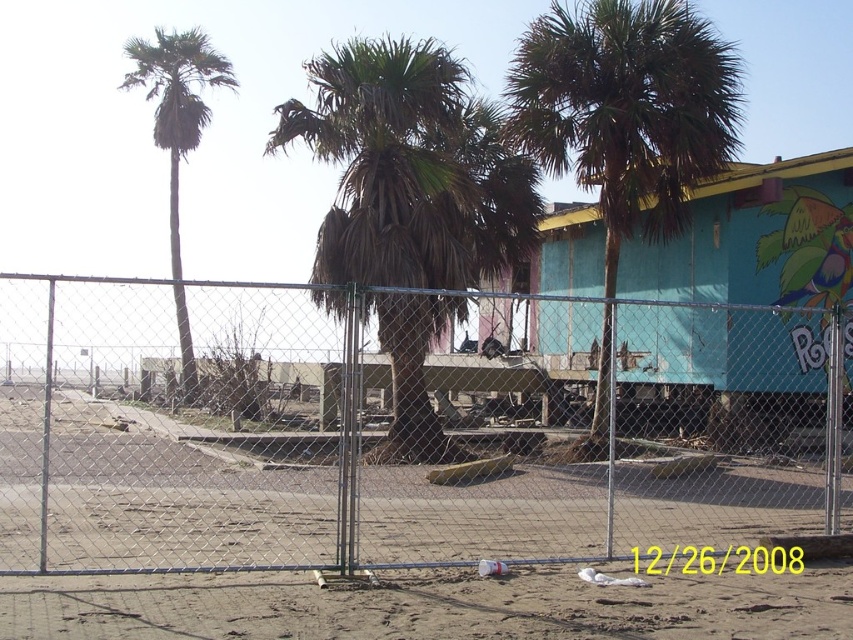
You are standing at the beach and see the teal painted wood cabin at center. If you want to take a photo of it, where should you position yourself relative to the chain link fence in the foreground?

The teal painted wood cabin at center is located at coordinates 0.373 on the x axis and 0.886 on the y axis, so you should position yourself to the right side of the chain link fence to capture it in your photo.

You are a visitor at the beachfront area and want to take a photo that includes both the teal painted wood cabin at center and the green leafy palm tree at center. Based on their sizes, which one should you position closer to the center of your camera frame to ensure both are visible?

The teal painted wood cabin at center is smaller than the green leafy palm tree at center. To ensure both are visible in the photo, you should position the teal painted wood cabin at center closer to the center of your camera frame since it is smaller and might need more emphasis to be clearly seen alongside the larger palm tree.